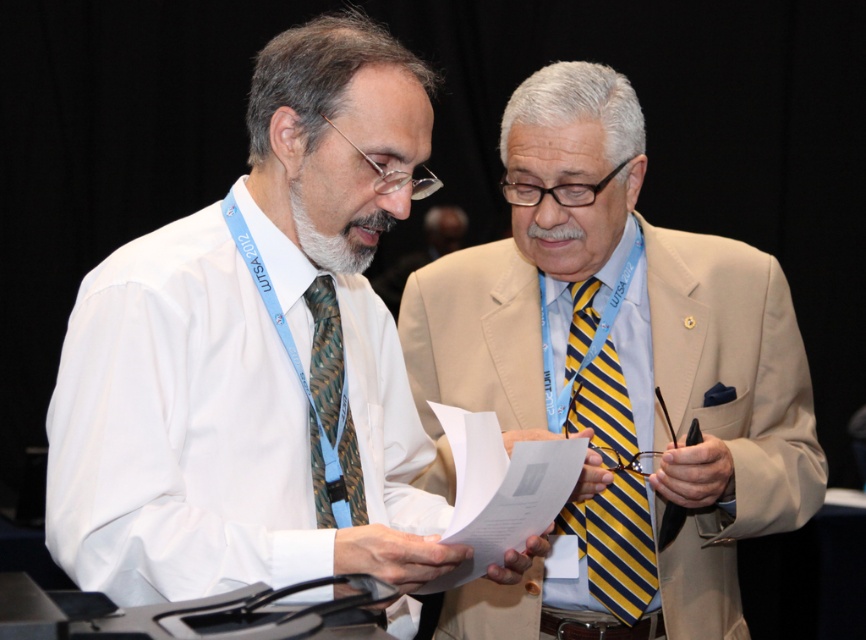
You are standing in a room where two men are talking. You see a beige fabric suit at right and a yellow striped tie at center. Which object is nearer to you?

The beige fabric suit at right is closer to the viewer than the yellow striped tie at center.

You are a photographer standing in front of the scene. You want to take a photo of the white silk shirt at center. Considering the distance between you and the shirt, can you use a standard camera lens with a minimum focusing distance of 1.5 meters?

The distance between the white silk shirt at center and the viewer is 1.49 meters, which is less than the camera lens minimum focusing distance of 1.5 meters. Therefore, you cannot focus on the white silk shirt at center with this lens.

The two men in the beige fabric suit at right and the man on the left are discussing documents. How far apart are they?

They are 6.60 feet apart.